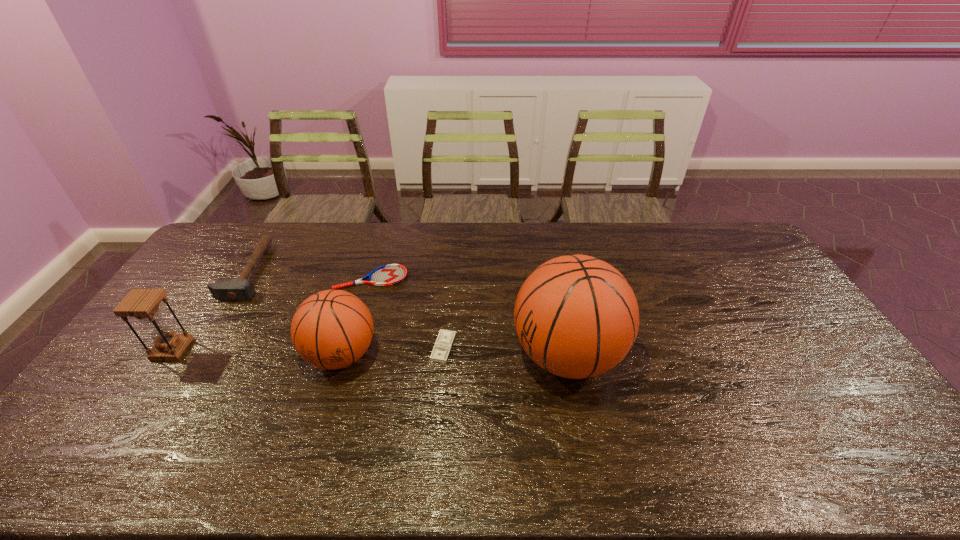
The height and width of the screenshot is (540, 960). In order to click on free region located 0.220m on the left of the tennis racket in this screenshot , I will do `click(273, 279)`.

You are a GUI agent. You are given a task and a screenshot of the screen. Output one action in this format:
    pyautogui.click(x=<x>, y=<y>)
    Task: Click on the blank area located on the right of the money
    The image size is (960, 540).
    Given the screenshot: What is the action you would take?
    pyautogui.click(x=590, y=348)

Identify the location of vacant space located on the back of the hourglass. (216, 285).

Locate an element on the screen. The height and width of the screenshot is (540, 960). object positioned at the far edge is located at coordinates (241, 289).

In order to click on object positioned at the near edge in this screenshot , I will do 576,316.

Identify the location of hammer positioned at the left edge. This screenshot has height=540, width=960. (241, 289).

Where is `hourglass that is at the left edge`? This screenshot has width=960, height=540. hourglass that is at the left edge is located at coordinates 143,304.

Locate an element on the screen. Image resolution: width=960 pixels, height=540 pixels. object positioned at the far left corner is located at coordinates (241, 289).

This screenshot has height=540, width=960. Find the location of `vacant region at the far edge of the desktop`. vacant region at the far edge of the desktop is located at coordinates point(491,222).

The image size is (960, 540). I want to click on free space at the near edge, so tap(504, 418).